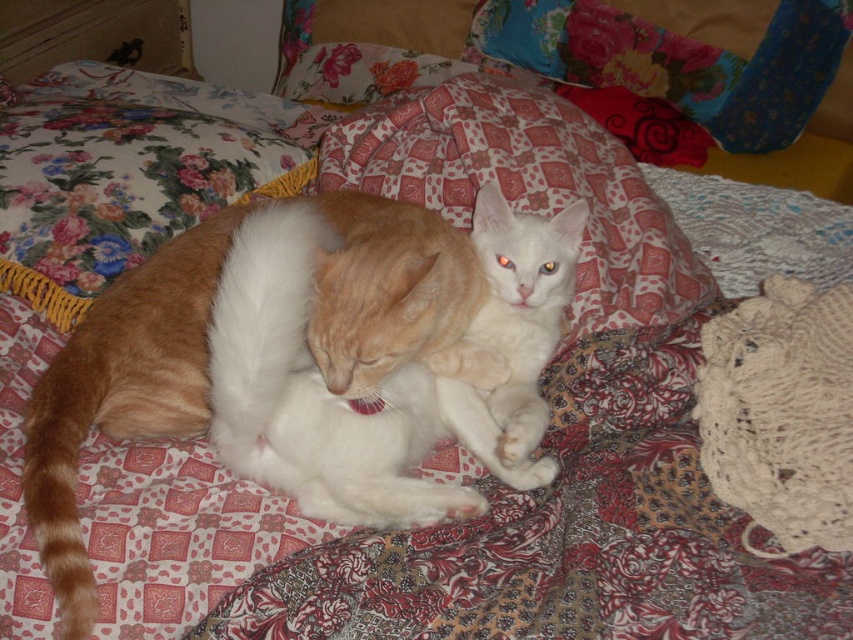
You are a photographer trying to capture both cats in a single shot. Given that the orange fur cat at center is taller than the white matte cat at center, which cat would you need to adjust the camera angle for to ensure both are fully visible in the frame?

Since the orange fur cat at center is taller than the white matte cat at center, you should adjust the camera angle slightly upward to accommodate the height of the orange fur cat at center while keeping the white matte cat at center in view.